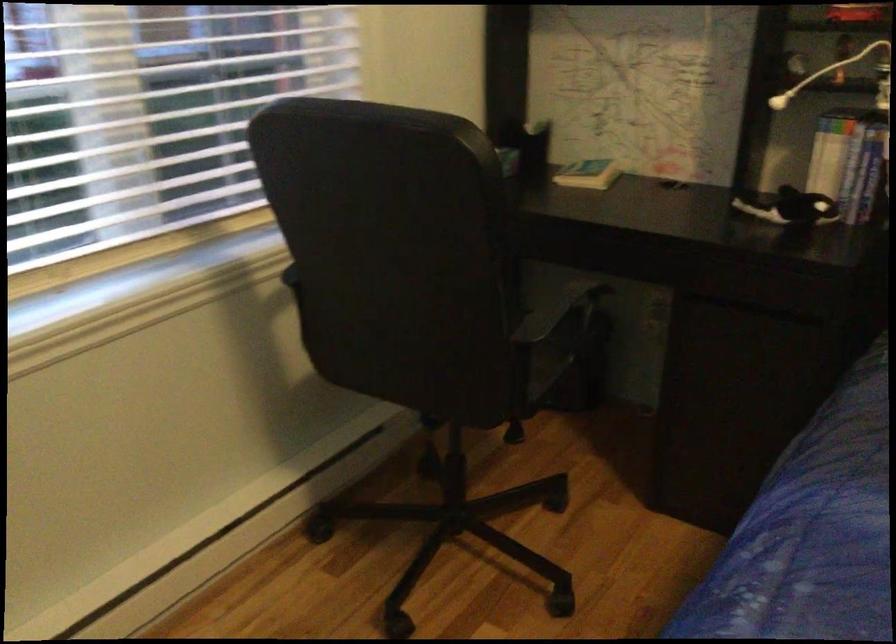
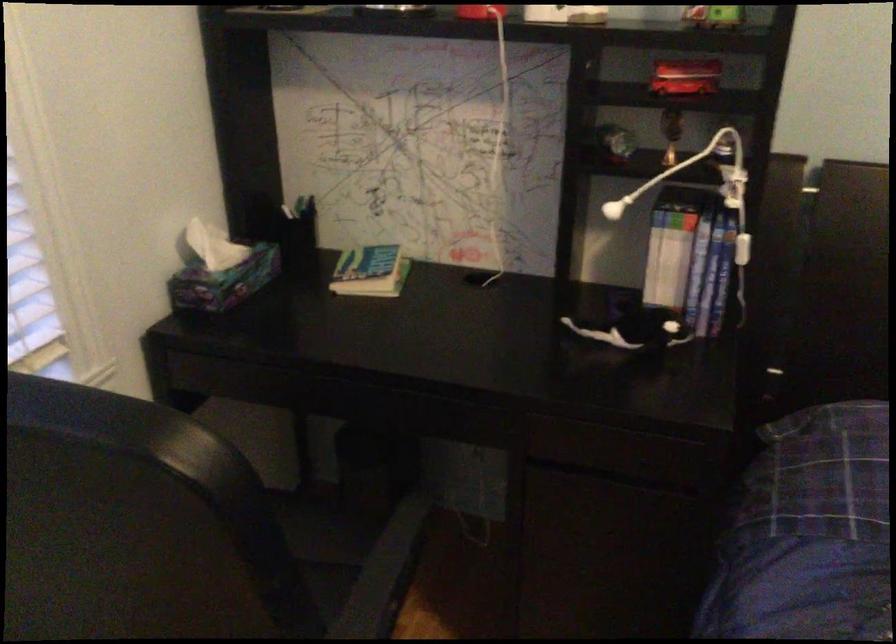
Where in the second image is the point corresponding to [481,173] from the first image?

(234, 509)